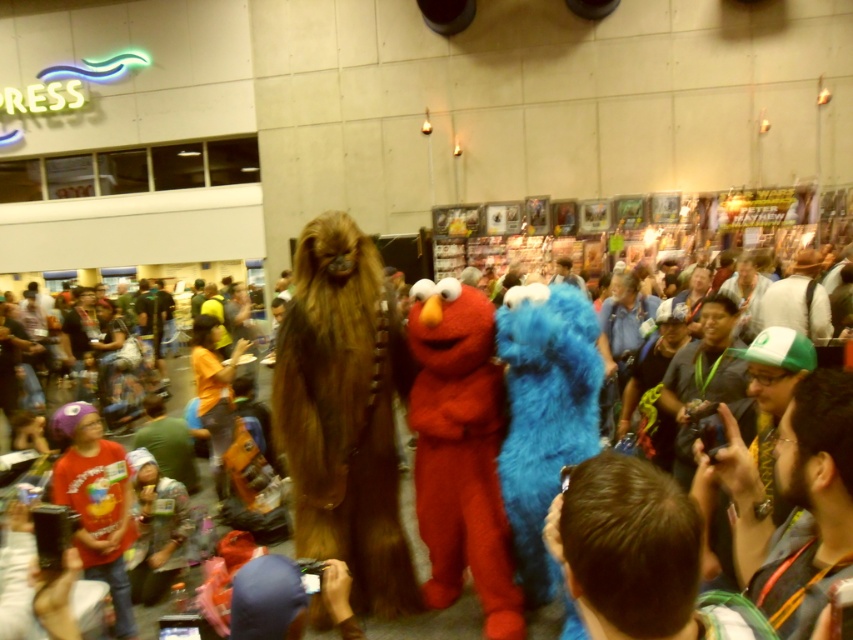
Question: Among these points, which one is nearest to the camera?

Choices:
 (A) (437, 616)
 (B) (86, 472)
 (C) (521, 586)
 (D) (376, 321)

Answer: (B)

Question: Is matte red t-shirt at lower left smaller than fuzzy costume at center?

Choices:
 (A) no
 (B) yes

Answer: (B)

Question: Is blue furry animal at center bigger than matte red t-shirt at lower left?

Choices:
 (A) no
 (B) yes

Answer: (A)

Question: Which object is the closest to the fuzzy brown fur at center?

Choices:
 (A) matte red t-shirt at lower left
 (B) fuzzy costume at center
 (C) blue furry animal at center

Answer: (C)

Question: Which point is closer to the camera?

Choices:
 (A) (305, 420)
 (B) (103, 480)
 (C) (581, 332)

Answer: (C)

Question: Does fuzzy brown fur at center have a larger size compared to fuzzy costume at center?

Choices:
 (A) yes
 (B) no

Answer: (B)